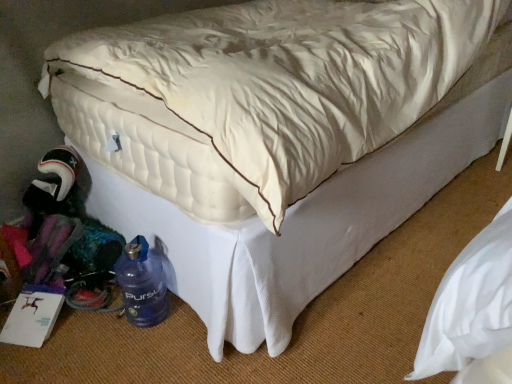
This screenshot has width=512, height=384. Identify the location of vacant space in front of blue translucent water bottle at lower left. (133, 350).